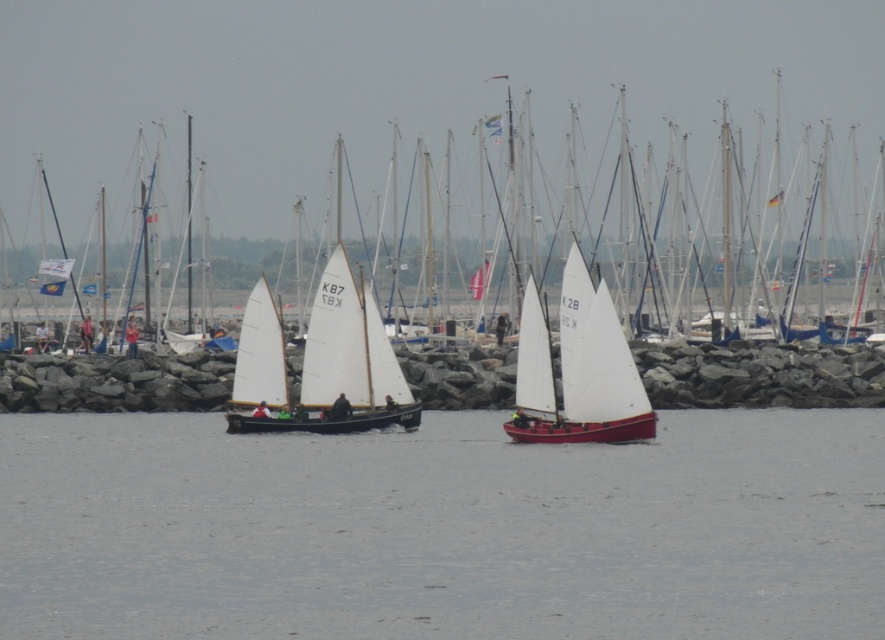
Question: Is clear water at center in front of white canvas sailboat at center?

Choices:
 (A) yes
 (B) no

Answer: (A)

Question: Does clear water at center appear under white canvas sailboat at center?

Choices:
 (A) yes
 (B) no

Answer: (A)

Question: Where is clear water at center located in relation to white canvas sailboat at center in the image?

Choices:
 (A) left
 (B) right

Answer: (A)